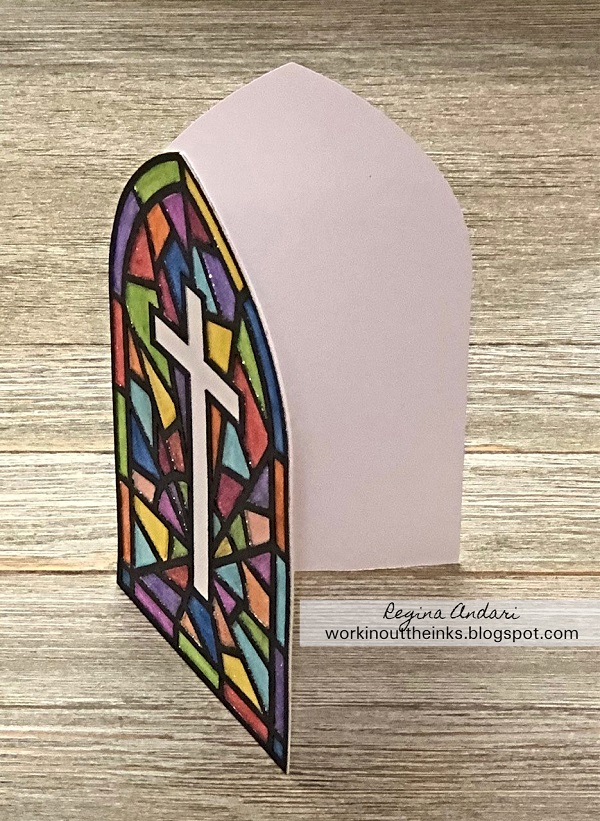
At what (x,y) coordinates should I click in order to perform the action: click on table. Please return your answer as a coordinate pair (x, y). Looking at the image, I should click on (26, 517).